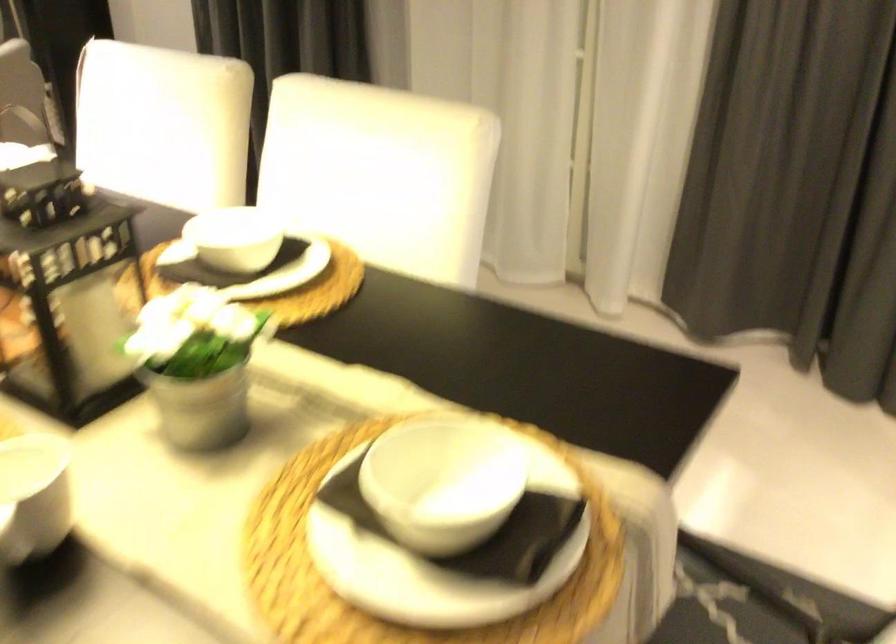
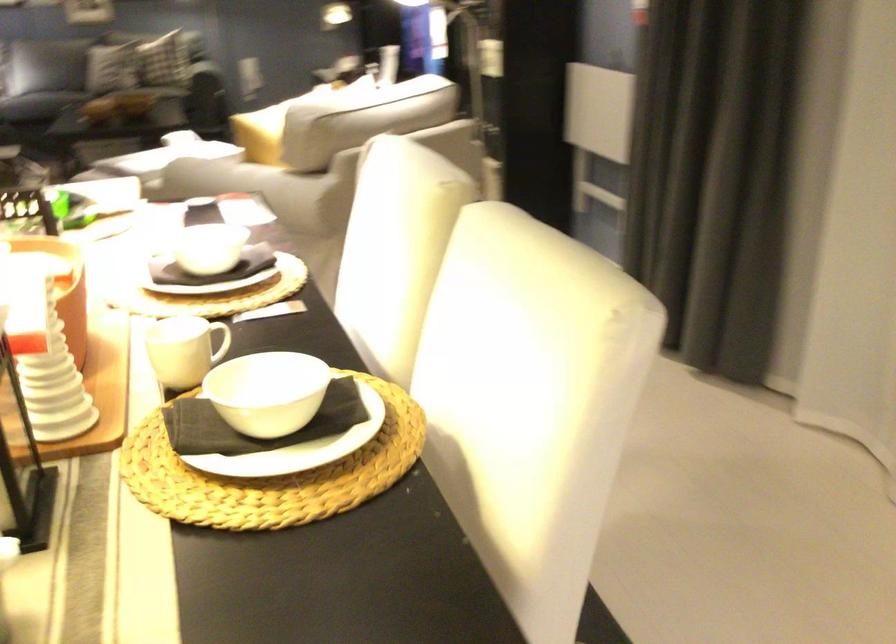
Question: The images are taken continuously from a first-person perspective. In which direction is your viewpoint rotating?

Choices:
 (A) Left
 (B) Right
 (C) Up
 (D) Down

Answer: (A)